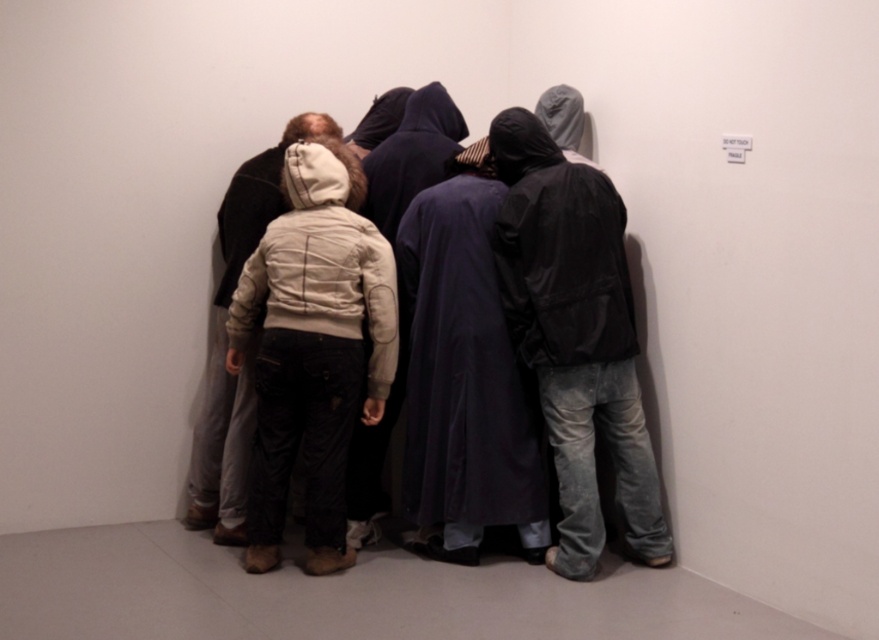
Is point (629, 518) in front of point (223, 342)?

Yes, point (629, 518) is closer to viewer.

Can you confirm if matte black jacket at center is taller than light beige jacket at center?

Indeed, matte black jacket at center has a greater height compared to light beige jacket at center.

What are the coordinates of `matte black jacket at center` in the screenshot? It's located at (575, 337).

Locate an element on the screen. The image size is (879, 640). matte black jacket at center is located at coordinates (575, 337).